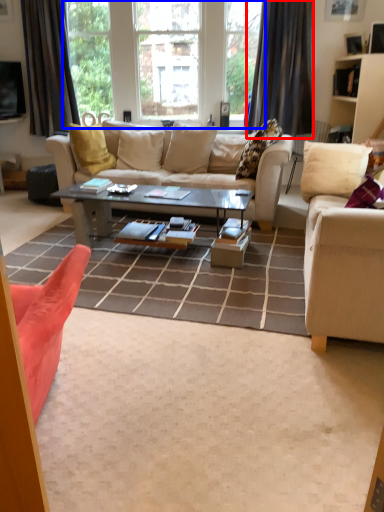
Question: Which object is further to the camera taking this photo, curtain (highlighted by a red box) or window (highlighted by a blue box)?

Choices:
 (A) curtain
 (B) window

Answer: (B)